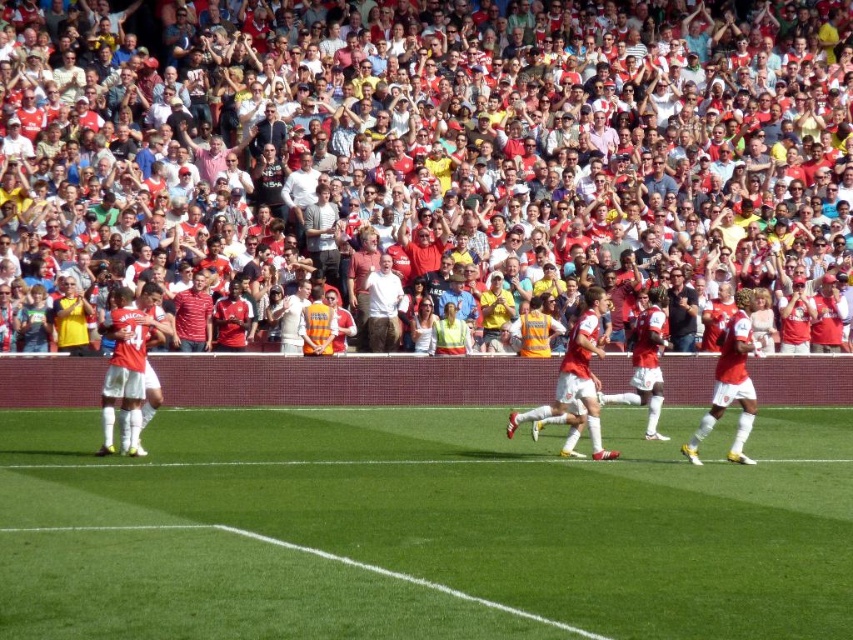
Which is in front, point (181, 220) or point (215, 500)?

Point (215, 500) is in front.

Does red jersey fans at center appear on the right side of green grass at center?

Correct, you'll find red jersey fans at center to the right of green grass at center.

What are the coordinates of `red jersey fans at center` in the screenshot? It's located at click(432, 157).

This screenshot has width=853, height=640. I want to click on red jersey fans at center, so click(432, 157).

Does point (216, 481) come in front of point (726, 323)?

Yes, point (216, 481) is closer to viewer.

In the scene shown: Does green grass at center have a larger size compared to matte red jersey at right?

Yes.

Is point (3, 488) farther from viewer compared to point (753, 346)?

No, it is in front of (753, 346).

Locate an element on the screen. green grass at center is located at coordinates (421, 529).

In the scene shown: Who is shorter, red jersey fans at center or matte red jersey at right?

With less height is matte red jersey at right.

In order to click on red jersey fans at center in this screenshot , I will do `click(432, 157)`.